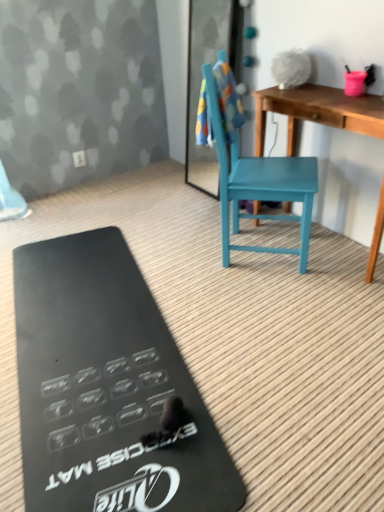
The width and height of the screenshot is (384, 512). What are the coordinates of `free space that is to the left of wooden desk at center` in the screenshot? It's located at (206, 258).